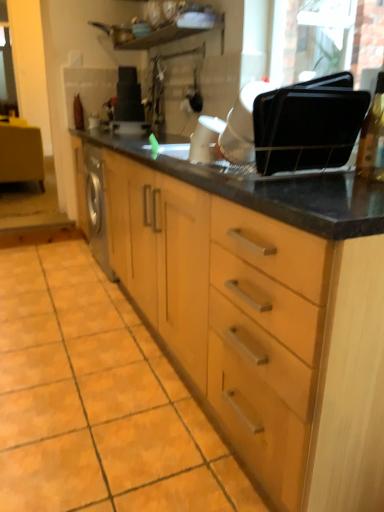
The image size is (384, 512). I want to click on black plastic trays at upper right, marked as the first appliance in a right-to-left arrangement, so click(308, 124).

Describe the element at coordinates (21, 154) in the screenshot. I see `matte wood vanity at left` at that location.

Describe the element at coordinates (242, 125) in the screenshot. I see `white glossy coffee maker at center, marked as the 2th appliance in a left-to-right arrangement` at that location.

At what (x,y) coordinates should I click in order to perform the action: click on black plastic trays at upper right, the 1th appliance viewed from the front. Please return your answer as a coordinate pair (x, y). Looking at the image, I should click on (308, 124).

Consider the image. From the image's perspective, is black matte toaster at upper center, the first appliance in the left-to-right sequence, located above or below white glossy coffee maker at center, marked as the 2th appliance in a left-to-right arrangement?

From the image's perspective, black matte toaster at upper center, the first appliance in the left-to-right sequence, appears above white glossy coffee maker at center, marked as the 2th appliance in a left-to-right arrangement.

Is black matte toaster at upper center, which is the third appliance from front to back, directly adjacent to white glossy coffee maker at center, placed as the second appliance when sorted from right to left?

They are not placed beside each other.

Measure the distance between black matte toaster at upper center, the 3th appliance positioned from the right, and white glossy coffee maker at center, the 2th appliance when ordered from front to back.

black matte toaster at upper center, the 3th appliance positioned from the right, and white glossy coffee maker at center, the 2th appliance when ordered from front to back, are 1.98 meters apart.

Is black matte toaster at upper center, the 3th appliance positioned from the right, smaller than white glossy coffee maker at center, the 2th appliance when ordered from front to back?

No.

Is there a large distance between black plastic trays at upper right, arranged as the 1th appliance when ordered from the bottom, and black matte toaster at upper center, the first appliance in the left-to-right sequence?

That's right, there is a large distance between black plastic trays at upper right, arranged as the 1th appliance when ordered from the bottom, and black matte toaster at upper center, the first appliance in the left-to-right sequence.

Could you tell me if black plastic trays at upper right, the 1th appliance viewed from the front, is turned towards black matte toaster at upper center, which appears as the 1th appliance when viewed from the top?

No, black plastic trays at upper right, the 1th appliance viewed from the front, is not facing towards black matte toaster at upper center, which appears as the 1th appliance when viewed from the top.

Could you measure the distance between black plastic trays at upper right, the 1th appliance viewed from the front, and black matte toaster at upper center, the 3th appliance positioned from the right?

Answer: They are 1.89 meters apart.

Which is correct: black plastic trays at upper right, the 3th appliance positioned from the left, is inside black matte toaster at upper center, which appears as the third appliance when ordered from the bottom, or outside of it?

The correct answer is: outside.

Does white glossy coffee maker at center, the 2th appliance when ordered from front to back, have a greater width compared to matte wood vanity at left?

No, white glossy coffee maker at center, the 2th appliance when ordered from front to back, is not wider than matte wood vanity at left.

What's the angular difference between white glossy coffee maker at center, placed as the 2th appliance when sorted from top to bottom, and matte wood vanity at left's facing directions?

180 degrees.

Identify the location of vanity that is under the white glossy coffee maker at center, the 2th appliance when ordered from front to back (from a real-world perspective). Image resolution: width=384 pixels, height=512 pixels. (21, 154).

Could you measure the distance between white glossy coffee maker at center, the 2th appliance when ordered from bottom to top, and matte wood vanity at left?

white glossy coffee maker at center, the 2th appliance when ordered from bottom to top, and matte wood vanity at left are 3.46 meters apart from each other.

From the picture: Is black matte toaster at upper center, which appears as the third appliance when ordered from the bottom, oriented away from orange matte tile at lower left?

That's not correct — black matte toaster at upper center, which appears as the third appliance when ordered from the bottom, is not looking away from orange matte tile at lower left.

Between black matte toaster at upper center, the 1th appliance from the back, and orange matte tile at lower left, which one appears on the right side from the viewer's perspective?

black matte toaster at upper center, the 1th appliance from the back, is more to the right.

Image resolution: width=384 pixels, height=512 pixels. Find the location of `ceramic tile in front of the black matte toaster at upper center, which appears as the 1th appliance when viewed from the top`. ceramic tile in front of the black matte toaster at upper center, which appears as the 1th appliance when viewed from the top is located at coordinates (97, 400).

From a real-world perspective, is black matte toaster at upper center, which is the third appliance from front to back, physically above orange matte tile at lower left?

Correct, in the physical world, black matte toaster at upper center, which is the third appliance from front to back, is higher than orange matte tile at lower left.

Does black matte toaster at upper center, the 1th appliance from the back, have a greater width compared to black plastic trays at upper right, the 3th appliance positioned from the left?

No, black matte toaster at upper center, the 1th appliance from the back, is not wider than black plastic trays at upper right, the 3th appliance positioned from the left.

Could you tell me if black matte toaster at upper center, the first appliance in the left-to-right sequence, is turned towards black plastic trays at upper right, arranged as the 1th appliance when ordered from the bottom?

No, black matte toaster at upper center, the first appliance in the left-to-right sequence, is not oriented towards black plastic trays at upper right, arranged as the 1th appliance when ordered from the bottom.

Can we say black matte toaster at upper center, which appears as the third appliance when ordered from the bottom, lies outside black plastic trays at upper right, the 1th appliance viewed from the front?

Yes.

Does point (134, 82) come behind point (318, 150)?

Yes, point (134, 82) is farther from viewer.

Is matte wood vanity at left next to orange matte tile at lower left and touching it?

No, matte wood vanity at left is not in contact with orange matte tile at lower left.

In the scene shown: Can you confirm if matte wood vanity at left is smaller than orange matte tile at lower left?

Incorrect, matte wood vanity at left is not smaller in size than orange matte tile at lower left.

At what (x,y) coordinates should I click in order to perform the action: click on ceramic tile below the matte wood vanity at left (from the image's perspective). Please return your answer as a coordinate pair (x, y). Looking at the image, I should click on (97, 400).

In the scene shown: Which of these two, matte wood vanity at left or orange matte tile at lower left, stands shorter?

With less height is orange matte tile at lower left.

Is orange matte tile at lower left touching black matte toaster at upper center, the first appliance in the left-to-right sequence?

orange matte tile at lower left is not next to black matte toaster at upper center, the first appliance in the left-to-right sequence, and they're not touching.

Is the depth of orange matte tile at lower left greater than that of black matte toaster at upper center, which is the third appliance from front to back?

No, it is in front of black matte toaster at upper center, which is the third appliance from front to back.

From the image's perspective, between orange matte tile at lower left and black matte toaster at upper center, the 1th appliance from the back, which one is located above?

black matte toaster at upper center, the 1th appliance from the back.

From a real-world perspective, is orange matte tile at lower left above or below black matte toaster at upper center, which appears as the 1th appliance when viewed from the top?

Clearly, from a real-world perspective, orange matte tile at lower left is below black matte toaster at upper center, which appears as the 1th appliance when viewed from the top.

Which appliance is the 1st one when counting from the right side of the black matte toaster at upper center, which is the third appliance from front to back? Please provide its 2D coordinates.

[(242, 125)]

Locate an element on the screen. Image resolution: width=384 pixels, height=512 pixels. appliance that is the 2nd object located above the black plastic trays at upper right, the 3th appliance positioned from the left (from the image's perspective) is located at coordinates (129, 104).

When comparing their distances from black plastic trays at upper right, the 1th appliance viewed from the front, does white glossy coffee maker at center, marked as the 2th appliance in a left-to-right arrangement, or black matte toaster at upper center, which appears as the third appliance when ordered from the bottom, seem further?

Among the two, black matte toaster at upper center, which appears as the third appliance when ordered from the bottom, is located further to black plastic trays at upper right, the 1th appliance viewed from the front.

Based on their spatial positions, is black plastic trays at upper right, the 3th appliance positioned from the left, or orange matte tile at lower left closer to white glossy coffee maker at center, marked as the 2th appliance in a left-to-right arrangement?

black plastic trays at upper right, the 3th appliance positioned from the left, lies closer to white glossy coffee maker at center, marked as the 2th appliance in a left-to-right arrangement, than the other object.

Which object lies nearer to the anchor point white glossy coffee maker at center, the 2th appliance when ordered from back to front, black plastic trays at upper right, the 3th appliance positioned from the left, or matte wood vanity at left?

Based on the image, black plastic trays at upper right, the 3th appliance positioned from the left, appears to be nearer to white glossy coffee maker at center, the 2th appliance when ordered from back to front.

From the image, which object appears to be nearer to black matte toaster at upper center, the 1th appliance from the back, matte wood vanity at left or black plastic trays at upper right, which is counted as the third appliance, starting from the back?

matte wood vanity at left is closer to black matte toaster at upper center, the 1th appliance from the back.

When comparing their distances from white glossy coffee maker at center, placed as the 2th appliance when sorted from top to bottom, does black plastic trays at upper right, which is counted as the third appliance, starting from the back, or black matte toaster at upper center, which appears as the third appliance when ordered from the bottom, seem closer?

black plastic trays at upper right, which is counted as the third appliance, starting from the back, is positioned closer to the anchor white glossy coffee maker at center, placed as the 2th appliance when sorted from top to bottom.

Based on their spatial positions, is orange matte tile at lower left or matte wood vanity at left closer to black matte toaster at upper center, the first appliance in the left-to-right sequence?

matte wood vanity at left.

Based on their spatial positions, is matte wood vanity at left or orange matte tile at lower left closer to black plastic trays at upper right, the third appliance in the top-to-bottom sequence?

Based on the image, orange matte tile at lower left appears to be nearer to black plastic trays at upper right, the third appliance in the top-to-bottom sequence.

Based on their spatial positions, is white glossy coffee maker at center, the 2th appliance when ordered from front to back, or black plastic trays at upper right, the 3th appliance positioned from the left, closer to matte wood vanity at left?

The object closer to matte wood vanity at left is white glossy coffee maker at center, the 2th appliance when ordered from front to back.

Where is `appliance between white glossy coffee maker at center, placed as the 2th appliance when sorted from top to bottom, and matte wood vanity at left from front to back`? The width and height of the screenshot is (384, 512). appliance between white glossy coffee maker at center, placed as the 2th appliance when sorted from top to bottom, and matte wood vanity at left from front to back is located at coordinates pyautogui.click(x=129, y=104).

This screenshot has width=384, height=512. What are the coordinates of `appliance positioned between black plastic trays at upper right, arranged as the 1th appliance when ordered from the bottom, and black matte toaster at upper center, the 3th appliance positioned from the right, from near to far` in the screenshot? It's located at (242, 125).